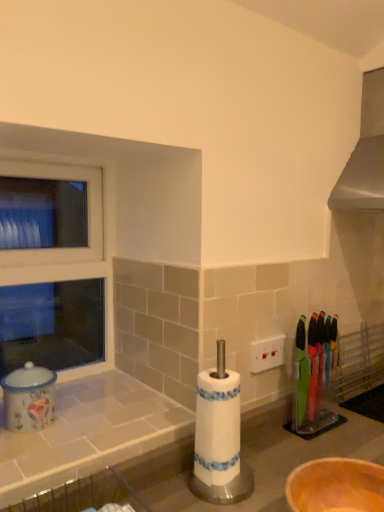
Locate an element on the screen. This screenshot has height=512, width=384. vacant region above white tile counter at lower left (from a real-world perspective) is located at coordinates (96, 406).